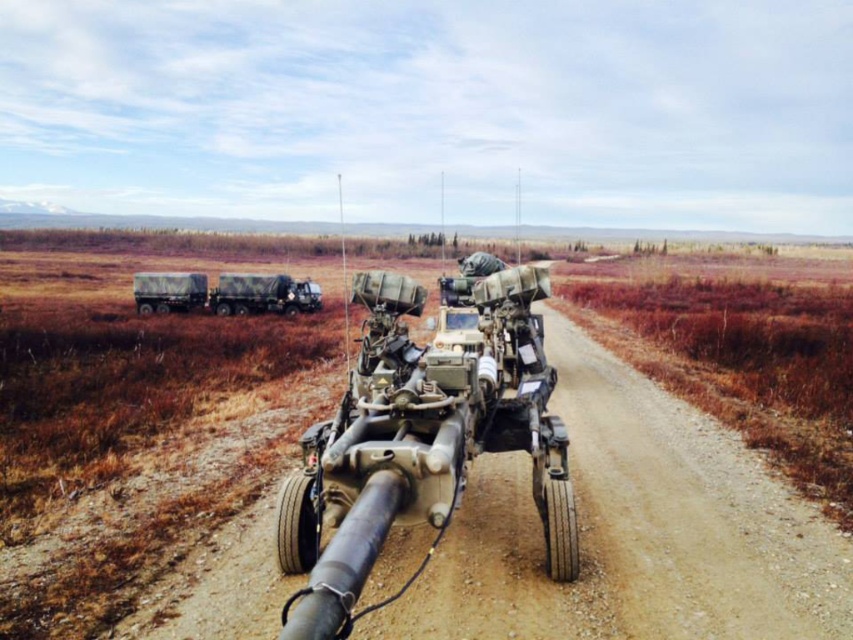
Question: Which object is positioned closest to the muddy camouflage truck at left?

Choices:
 (A) camouflage fabric tank at center
 (B) camouflage fabric truck at left

Answer: (B)

Question: Does camouflage fabric tank at center appear over muddy camouflage truck at left?

Choices:
 (A) no
 (B) yes

Answer: (A)

Question: Is camouflage fabric tank at center below muddy camouflage truck at left?

Choices:
 (A) yes
 (B) no

Answer: (A)

Question: Which point is closer to the camera?

Choices:
 (A) (173, 305)
 (B) (216, 289)
 (C) (375, 460)

Answer: (C)

Question: Is camouflage fabric tank at center positioned in front of camouflage fabric truck at left?

Choices:
 (A) no
 (B) yes

Answer: (B)

Question: Which point is farther from the camera taking this photo?

Choices:
 (A) (200, 308)
 (B) (438, 516)

Answer: (A)